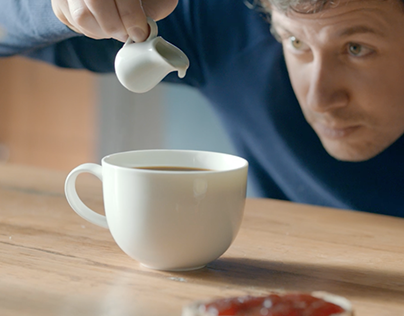
Locate an element on the screen. The height and width of the screenshot is (316, 404). light brown table surface is located at coordinates (40, 234), (346, 226), (45, 295).